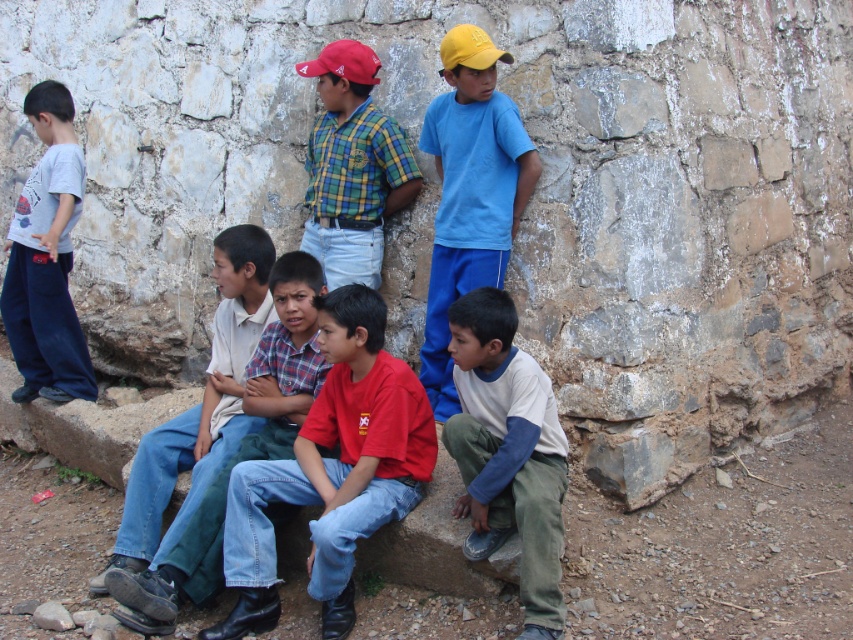
In the scene shown: You are standing at the origin point in the image. There are two points marked in the scene. Which point is closer to you, point (363, 264) or point (352, 80)?

Point (352, 80) is closer to you because it is in front of point (363, 264).

Looking at this image, you are a photographer trying to capture a group shot of the children. You notice the plaid shirt at center and the matte red baseball cap at upper center. Which object should you adjust to ensure both are fully visible in the frame?

Since the plaid shirt at center is taller than the matte red baseball cap at upper center, you should lower the camera angle slightly to accommodate the height of the plaid shirt at center while keeping the matte red baseball cap at upper center in view.

You are a photographer trying to capture a clear shot of the jeans at center and the matte red baseball cap at upper center. Since the camera can only focus on one object at a time, which one should you focus on first to ensure it appears sharp in the photo?

You should focus on the jeans at center first because it is closer to the viewer than the matte red baseball cap at upper center, making it the foreground object.